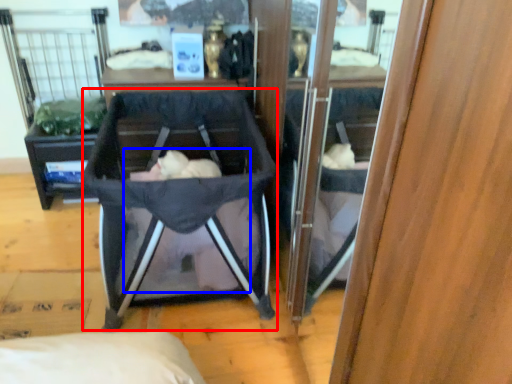
Question: Which object appears farthest to the camera in this image, baby carriage (highlighted by a red box) or baby (highlighted by a blue box)?

Choices:
 (A) baby carriage
 (B) baby

Answer: (B)